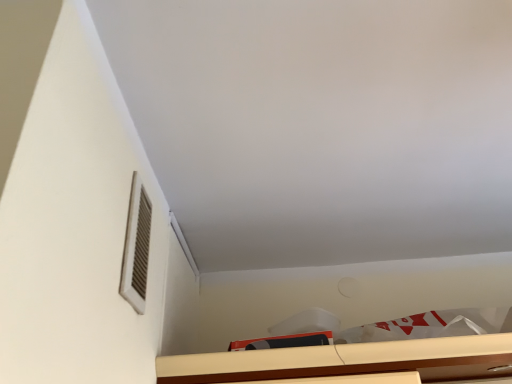
Question: Does wooden cabinet at lower center have a smaller size compared to white matte vent at upper left?

Choices:
 (A) yes
 (B) no

Answer: (B)

Question: Considering the relative positions of wooden cabinet at lower center and white matte vent at upper left in the image provided, is wooden cabinet at lower center to the left of white matte vent at upper left from the viewer's perspective?

Choices:
 (A) no
 (B) yes

Answer: (A)

Question: Considering the relative sizes of wooden cabinet at lower center and white matte vent at upper left in the image provided, is wooden cabinet at lower center thinner than white matte vent at upper left?

Choices:
 (A) no
 (B) yes

Answer: (A)

Question: Can you confirm if wooden cabinet at lower center is bigger than white matte vent at upper left?

Choices:
 (A) yes
 (B) no

Answer: (A)

Question: From a real-world perspective, is wooden cabinet at lower center beneath white matte vent at upper left?

Choices:
 (A) yes
 (B) no

Answer: (A)

Question: Would you say wooden cabinet at lower center is a long distance from white matte vent at upper left?

Choices:
 (A) no
 (B) yes

Answer: (A)

Question: Is white matte vent at upper left at the left side of wooden cabinet at lower center?

Choices:
 (A) no
 (B) yes

Answer: (B)

Question: Is white matte vent at upper left bigger than wooden cabinet at lower center?

Choices:
 (A) no
 (B) yes

Answer: (A)

Question: Is white matte vent at upper left looking in the opposite direction of wooden cabinet at lower center?

Choices:
 (A) no
 (B) yes

Answer: (A)

Question: Does white matte vent at upper left appear on the right side of wooden cabinet at lower center?

Choices:
 (A) yes
 (B) no

Answer: (B)

Question: Considering the relative sizes of white matte vent at upper left and wooden cabinet at lower center in the image provided, is white matte vent at upper left smaller than wooden cabinet at lower center?

Choices:
 (A) yes
 (B) no

Answer: (A)

Question: Does white matte vent at upper left lie in front of wooden cabinet at lower center?

Choices:
 (A) yes
 (B) no

Answer: (A)

Question: Based on their positions, is white matte vent at upper left located to the left or right of wooden cabinet at lower center?

Choices:
 (A) left
 (B) right

Answer: (A)